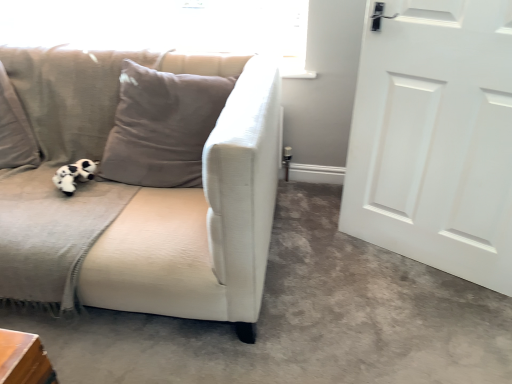
This screenshot has width=512, height=384. Identify the location of free space that is to the left of white matte door at right. (331, 263).